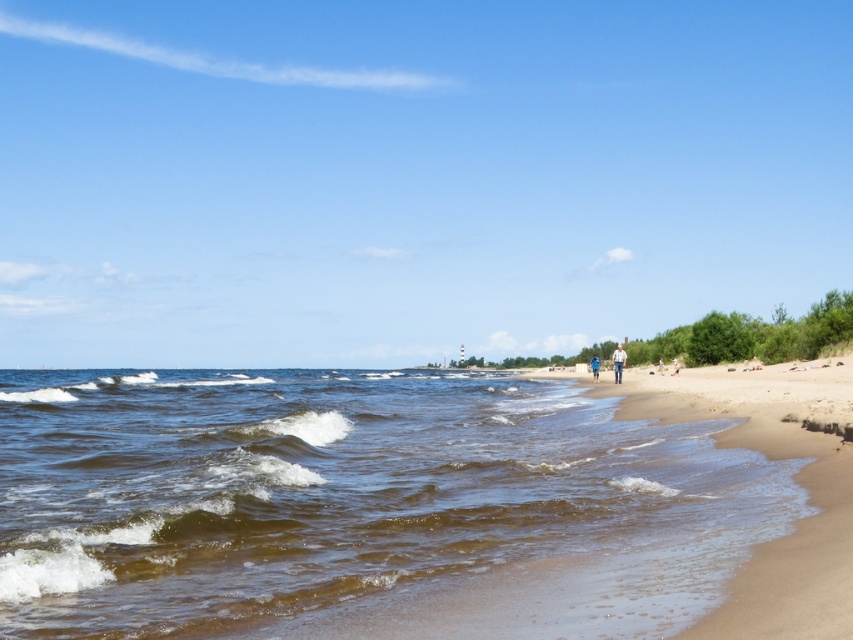
Can you confirm if light brown leather jacket at center is wider than blue denim shorts at center?

Indeed, light brown leather jacket at center has a greater width compared to blue denim shorts at center.

Who is more forward, (618, 356) or (590, 369)?

Point (618, 356)

I want to click on light brown leather jacket at center, so click(618, 362).

Does brown sandy water at lower left have a larger size compared to blue denim shorts at center?

Yes.

Is point (624, 451) more distant than point (595, 376)?

No, (624, 451) is in front of (595, 376).

You are a GUI agent. You are given a task and a screenshot of the screen. Output one action in this format:
    pyautogui.click(x=<x>, y=<y>)
    Task: Click on the brown sandy water at lower left
    The height and width of the screenshot is (640, 853).
    Given the screenshot: What is the action you would take?
    pyautogui.click(x=306, y=490)

Does brown sandy water at lower left appear on the left side of light brown leather jacket at center?

Indeed, brown sandy water at lower left is positioned on the left side of light brown leather jacket at center.

Between brown sandy water at lower left and light brown leather jacket at center, which one has less height?

Standing shorter between the two is light brown leather jacket at center.

Does point (163, 573) come closer to viewer compared to point (621, 349)?

Yes.

Where is `brown sandy water at lower left`? The width and height of the screenshot is (853, 640). brown sandy water at lower left is located at coordinates (306, 490).